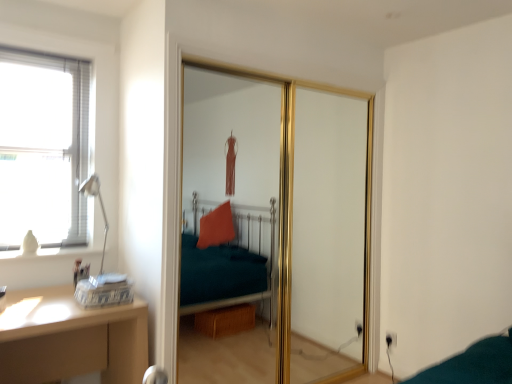
Question: Is wooden desk at lower left shorter than matte silver table lamp at left?

Choices:
 (A) no
 (B) yes

Answer: (A)

Question: Is wooden desk at lower left turned away from matte silver table lamp at left?

Choices:
 (A) no
 (B) yes

Answer: (A)

Question: Does wooden desk at lower left have a greater height compared to matte silver table lamp at left?

Choices:
 (A) yes
 (B) no

Answer: (A)

Question: Does wooden desk at lower left have a greater width compared to matte silver table lamp at left?

Choices:
 (A) yes
 (B) no

Answer: (A)

Question: Is matte silver table lamp at left located within wooden desk at lower left?

Choices:
 (A) no
 (B) yes

Answer: (A)

Question: Is wooden desk at lower left thinner than matte silver table lamp at left?

Choices:
 (A) yes
 (B) no

Answer: (B)

Question: Does matte silver table lamp at left come behind gold metallic sliding door at center?

Choices:
 (A) yes
 (B) no

Answer: (A)

Question: Are matte silver table lamp at left and gold metallic sliding door at center beside each other?

Choices:
 (A) yes
 (B) no

Answer: (B)

Question: Would you say matte silver table lamp at left is a long distance from gold metallic sliding door at center?

Choices:
 (A) no
 (B) yes

Answer: (B)

Question: From the image's perspective, would you say matte silver table lamp at left is shown under gold metallic sliding door at center?

Choices:
 (A) yes
 (B) no

Answer: (B)

Question: Considering the relative positions of matte silver table lamp at left and gold metallic sliding door at center in the image provided, is matte silver table lamp at left in front of gold metallic sliding door at center?

Choices:
 (A) no
 (B) yes

Answer: (A)

Question: Is gold metallic sliding door at center at the back of matte silver table lamp at left?

Choices:
 (A) no
 (B) yes

Answer: (A)

Question: Considering the relative positions of gold metallic sliding door at center and wooden desk at lower left in the image provided, is gold metallic sliding door at center to the left of wooden desk at lower left from the viewer's perspective?

Choices:
 (A) no
 (B) yes

Answer: (A)